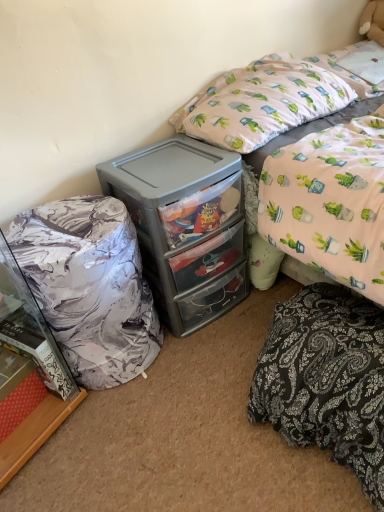
Where is `vacant space that is to the left of black paisley fabric at lower right`? vacant space that is to the left of black paisley fabric at lower right is located at coordinates (196, 431).